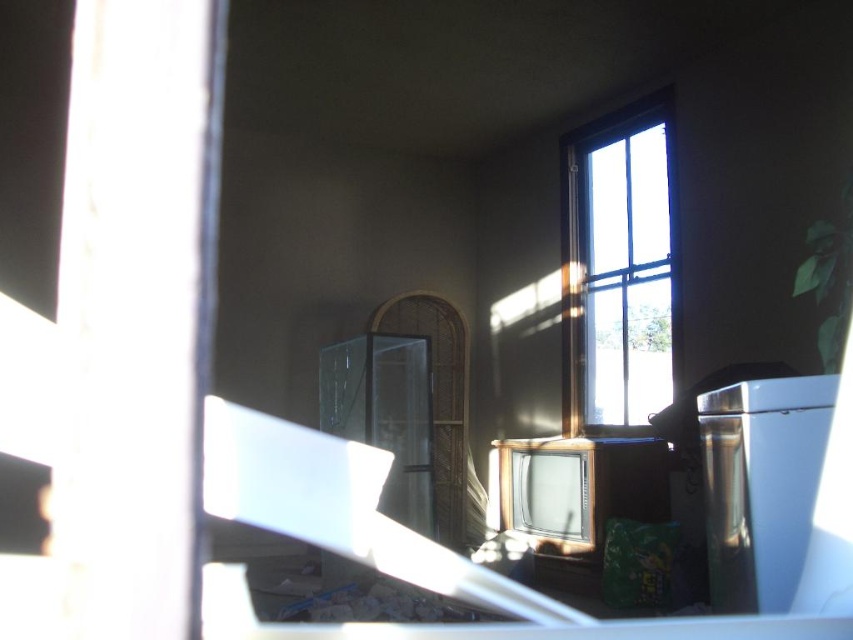
Question: Is clear glass window at upper right above satin silver trash can at right?

Choices:
 (A) no
 (B) yes

Answer: (B)

Question: Does clear glass window at upper right appear under satin silver trash can at right?

Choices:
 (A) no
 (B) yes

Answer: (A)

Question: Considering the relative positions of satin silver trash can at right and metallic silver television at center in the image provided, where is satin silver trash can at right located with respect to metallic silver television at center?

Choices:
 (A) left
 (B) right

Answer: (A)

Question: Which object appears farthest from the camera in this image?

Choices:
 (A) metallic silver television at center
 (B) satin silver trash can at right
 (C) clear glass window at upper right

Answer: (C)

Question: Which point appears closest to the camera in this image?

Choices:
 (A) (666, 476)
 (B) (733, 512)

Answer: (B)

Question: Which of the following is the closest to the observer?

Choices:
 (A) clear glass window at upper right
 (B) metallic silver television at center

Answer: (B)